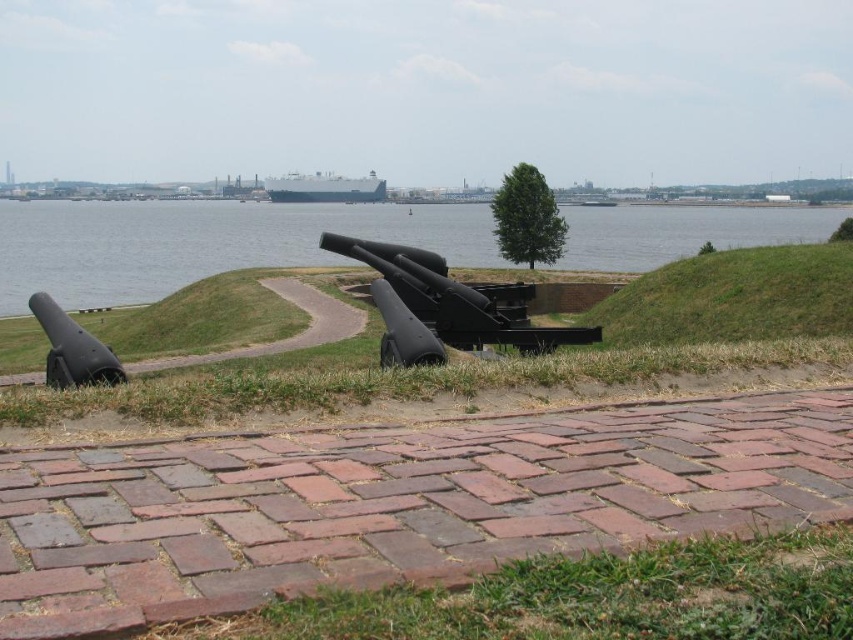
Question: Among these objects, which one is farthest from the camera?

Choices:
 (A) black matte cannon at center
 (B) matte black cannon at left

Answer: (A)

Question: Does black matte cannon at center have a smaller size compared to matte black cannon at left?

Choices:
 (A) no
 (B) yes

Answer: (A)

Question: Which object is the farthest from the black matte cannon at center?

Choices:
 (A) blue water at center
 (B) matte black cannon at left

Answer: (A)

Question: Does black matte cannon at center have a lesser width compared to matte black cannon at left?

Choices:
 (A) no
 (B) yes

Answer: (B)

Question: Can you confirm if blue water at center is bigger than black matte cannon at center?

Choices:
 (A) yes
 (B) no

Answer: (A)

Question: Considering the real-world distances, which object is farthest from the matte black cannon at left?

Choices:
 (A) black matte cannon at center
 (B) blue water at center

Answer: (B)